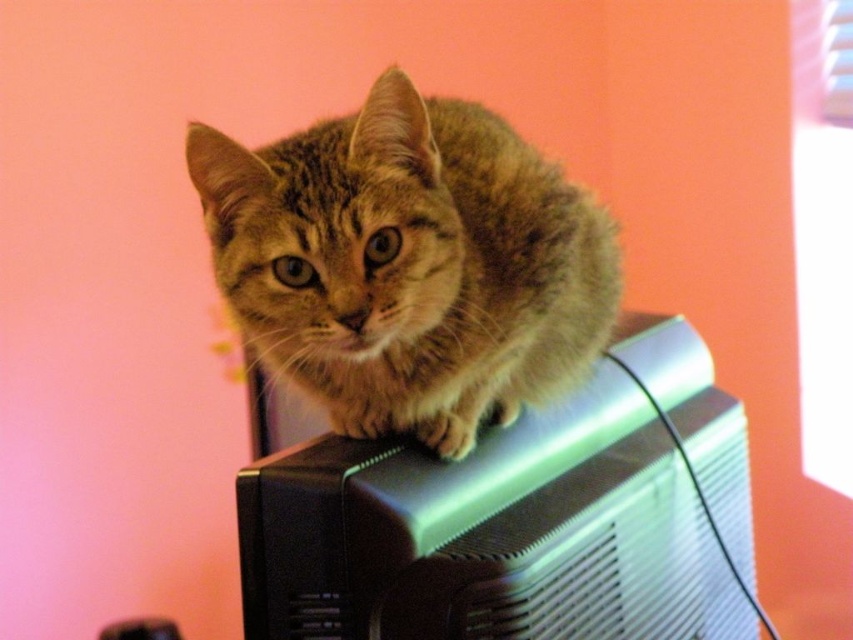
Question: Which point is farther from the camera taking this photo?

Choices:
 (A) (343, 611)
 (B) (585, 349)

Answer: (B)

Question: Which point is closer to the camera taking this photo?

Choices:
 (A) (242, 148)
 (B) (585, 396)

Answer: (A)

Question: Which of the following is the farthest from the observer?

Choices:
 (A) metallic silver computer at upper center
 (B) fuzzy brown cat at center

Answer: (A)

Question: Does metallic silver computer at upper center have a smaller size compared to fuzzy brown cat at center?

Choices:
 (A) yes
 (B) no

Answer: (B)

Question: Does metallic silver computer at upper center appear on the left side of fuzzy brown cat at center?

Choices:
 (A) no
 (B) yes

Answer: (A)

Question: Can you confirm if metallic silver computer at upper center is bigger than fuzzy brown cat at center?

Choices:
 (A) yes
 (B) no

Answer: (A)